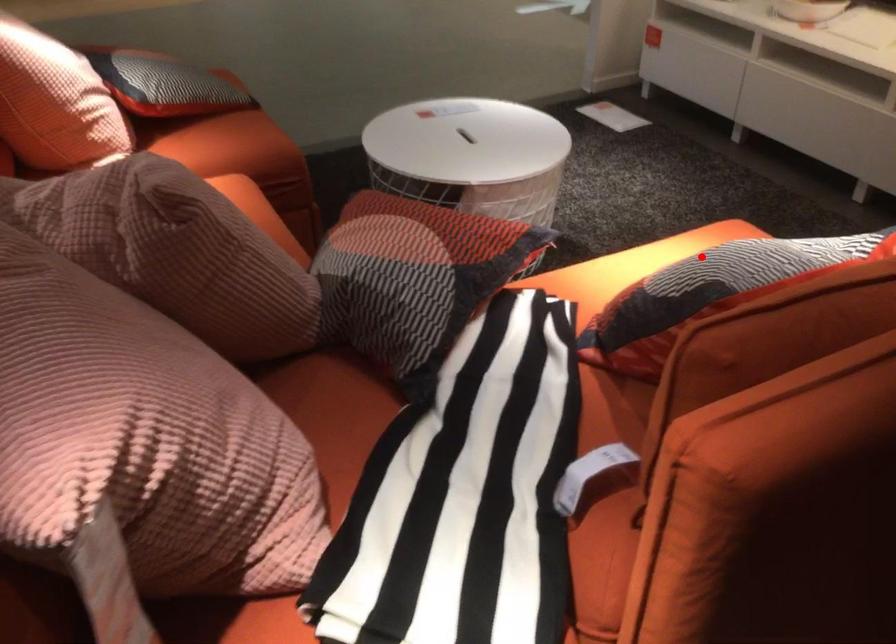
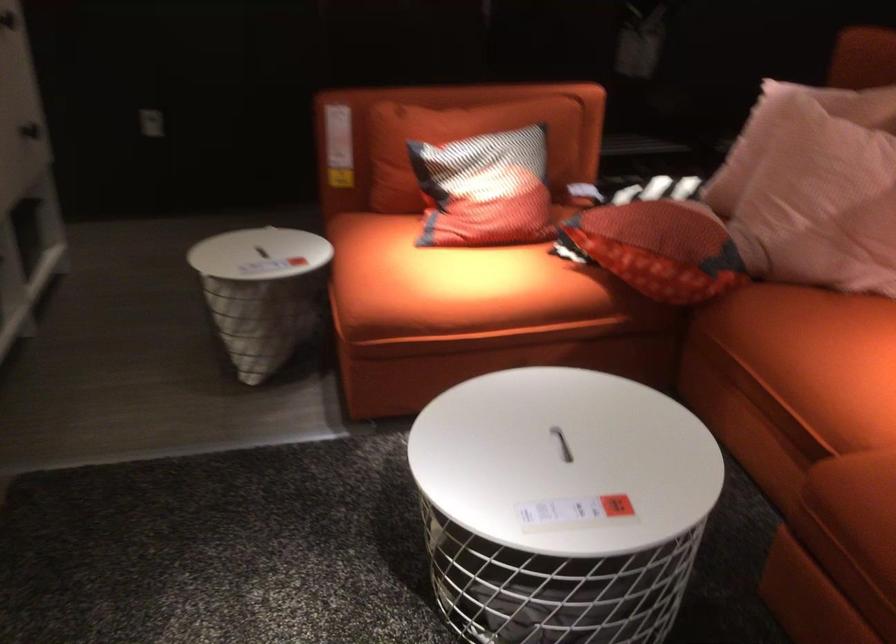
Question: I am providing you with two images of the same scene from different viewpoints. In image1, a red point is highlighted. Considering the same 3D point in image2, which of the following is correct?

Choices:
 (A) It is closer
 (B) It is farther

Answer: (B)